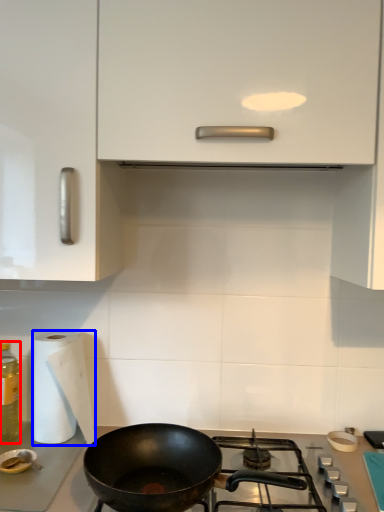
Question: Among these objects, which one is nearest to the camera, bottle (highlighted by a red box) or paper towel (highlighted by a blue box)?

Choices:
 (A) bottle
 (B) paper towel

Answer: (B)